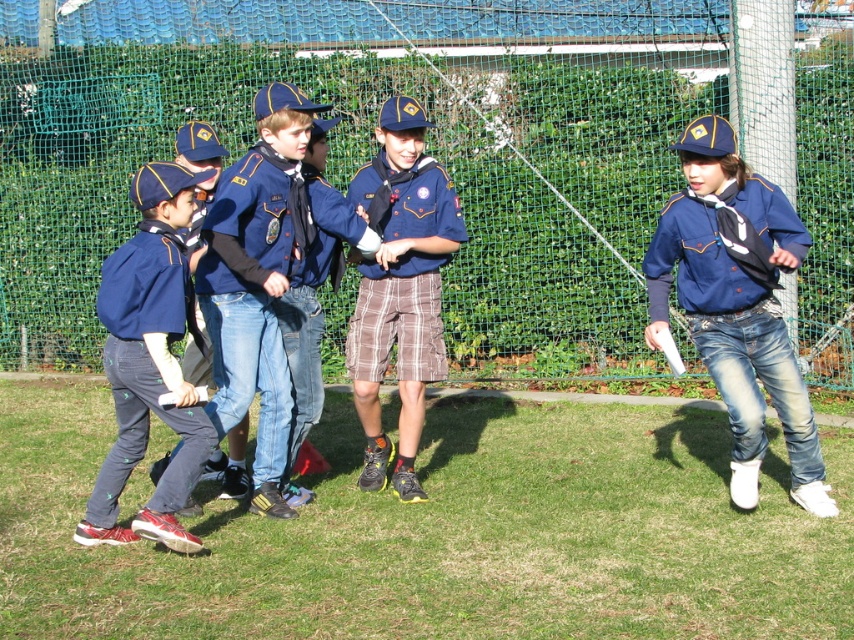
In the scene shown: Who is more forward, (787, 256) or (361, 413)?

Point (787, 256) is in front.

Can you confirm if matte blue shirt at center is positioned to the left of plaid shorts at center?

Incorrect, matte blue shirt at center is not on the left side of plaid shorts at center.

The width and height of the screenshot is (854, 640). What do you see at coordinates (736, 304) in the screenshot? I see `matte blue shirt at center` at bounding box center [736, 304].

The image size is (854, 640). I want to click on matte blue shirt at center, so click(736, 304).

Between green grass at lower center and matte blue shirt at center, which one is positioned higher?

matte blue shirt at center

Which of these two, green grass at lower center or matte blue shirt at center, stands shorter?

With less height is green grass at lower center.

Between point (344, 605) and point (746, 228), which one is positioned behind?

The point (746, 228) is behind.

Find the location of a particular element. The width and height of the screenshot is (854, 640). green grass at lower center is located at coordinates (437, 532).

Can you confirm if matte blue shirt at center is positioned to the right of matte blue uniform at left?

Indeed, matte blue shirt at center is positioned on the right side of matte blue uniform at left.

Locate an element on the screen. matte blue shirt at center is located at coordinates (736, 304).

This screenshot has height=640, width=854. I want to click on matte blue shirt at center, so click(736, 304).